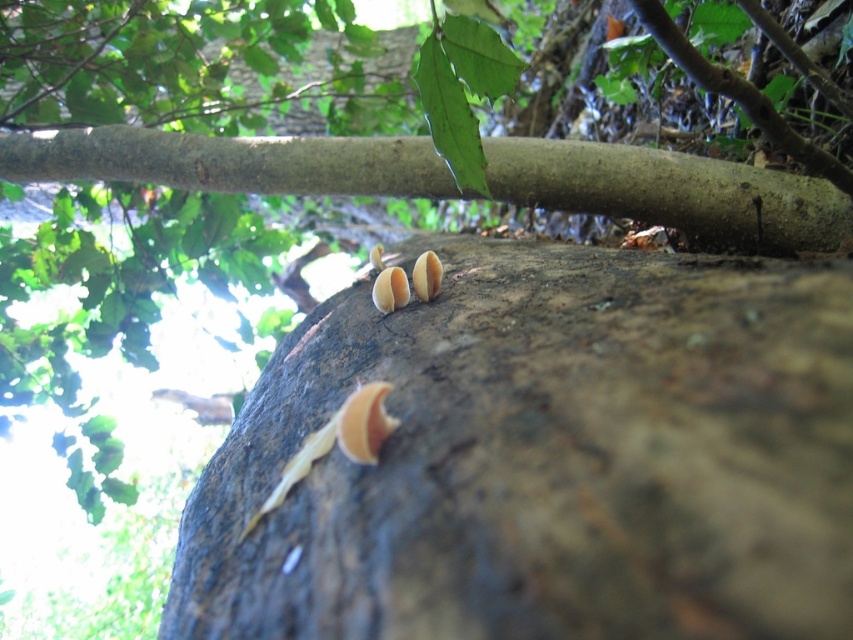
Question: Does smooth brown branch at upper center appear on the right side of smooth beige fungi at center?

Choices:
 (A) no
 (B) yes

Answer: (A)

Question: Which point is closer to the camera?

Choices:
 (A) (135, 172)
 (B) (434, 273)

Answer: (B)

Question: Does smooth brown branch at upper center appear on the left side of smooth beige fungi at center?

Choices:
 (A) no
 (B) yes

Answer: (B)

Question: Does brown rough bark at center appear on the right side of brown matte fungi at center?

Choices:
 (A) no
 (B) yes

Answer: (A)

Question: Estimate the real-world distances between objects in this image. Which object is farther from the brown matte fungi at center?

Choices:
 (A) brown rough bark at center
 (B) smooth brown branch at upper center
 (C) smooth beige fungi at center

Answer: (B)

Question: Considering the real-world distances, which object is farthest from the brown rough bark at center?

Choices:
 (A) brown matte fungi at center
 (B) smooth brown branch at upper center

Answer: (B)